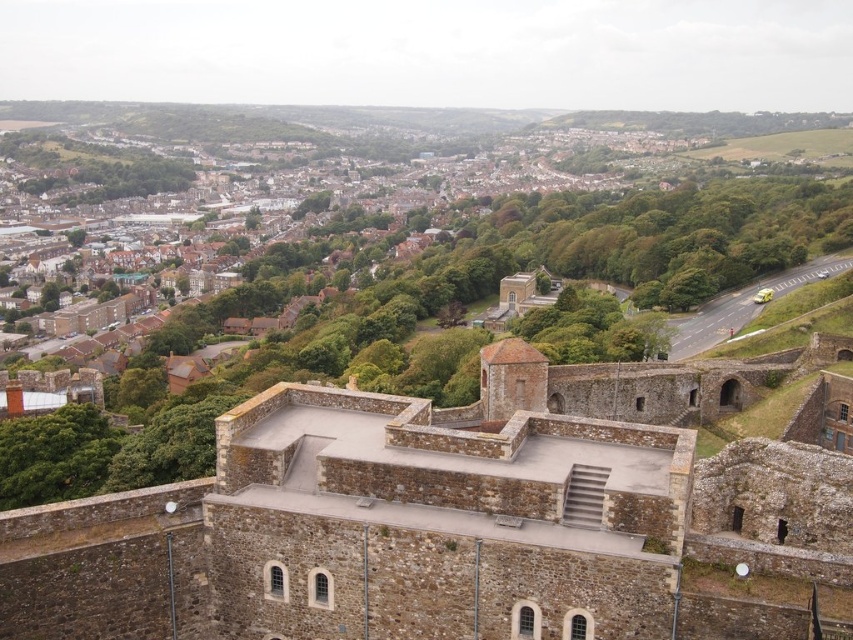
You are an architect reviewing this urban design. You need to determine which structure is more prominent in the foreground for a presentation. Which one is closer to the viewer between the brown stone castle at center and the brown brick town at upper center?

The brown stone castle at center is closer to the viewer than the brown brick town at upper center, making it more prominent in the foreground.

You are a tourist standing on the flat roof of the medieval stone wall in the foreground. You want to take a photo that includes both the brown stone castle at center and the brown brick town at upper center. Which direction should you face to ensure both are visible in the frame?

You should face to the left because the brown stone castle at center is to the right of the brown brick town at upper center, so turning left will allow both to be captured in the frame.

You are a tourist standing on a hill overlooking the brown stone castle at center and the brown brick town at upper center. Which structure has a greater height?

The brown brick town at upper center is taller than the brown stone castle at center.